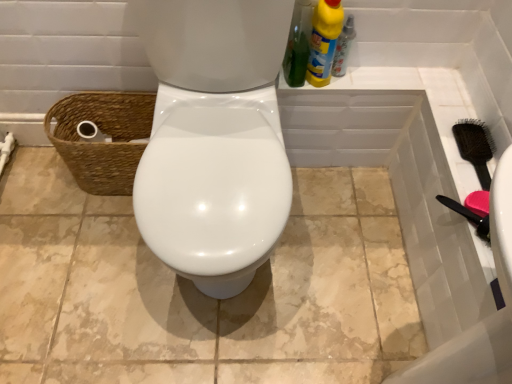
Question: Does yellow liquid cleaner at upper right, which is the 2th cleaning product from right to left, turn towards black plastic brush at right?

Choices:
 (A) no
 (B) yes

Answer: (A)

Question: From the image's perspective, would you say yellow liquid cleaner at upper right, which is the 2th cleaning product from right to left, is shown under black plastic brush at right?

Choices:
 (A) yes
 (B) no

Answer: (B)

Question: Is yellow liquid cleaner at upper right, which is the first cleaning product in left-to-right order, taller than black plastic brush at right?

Choices:
 (A) yes
 (B) no

Answer: (A)

Question: Is yellow liquid cleaner at upper right, which is the first cleaning product in left-to-right order, not inside black plastic brush at right?

Choices:
 (A) no
 (B) yes

Answer: (B)

Question: Considering the relative positions of yellow liquid cleaner at upper right, which is the first cleaning product in left-to-right order, and black plastic brush at right in the image provided, is yellow liquid cleaner at upper right, which is the first cleaning product in left-to-right order, in front of black plastic brush at right?

Choices:
 (A) yes
 (B) no

Answer: (A)

Question: From the image's perspective, is yellow plastic bottle at upper right positioned above or below brown woven basket at left?

Choices:
 (A) above
 (B) below

Answer: (A)

Question: Is yellow plastic bottle at upper right bigger or smaller than brown woven basket at left?

Choices:
 (A) small
 (B) big

Answer: (A)

Question: Is yellow plastic bottle at upper right in front of or behind brown woven basket at left in the image?

Choices:
 (A) behind
 (B) front

Answer: (B)

Question: Is yellow plastic bottle at upper right inside the boundaries of brown woven basket at left, or outside?

Choices:
 (A) outside
 (B) inside

Answer: (A)

Question: Considering the positions of yellow plastic bottle at upper right, placed as the first cleaning product when sorted from right to left, and brown woven basket at left in the image, is yellow plastic bottle at upper right, placed as the first cleaning product when sorted from right to left, bigger or smaller than brown woven basket at left?

Choices:
 (A) small
 (B) big

Answer: (A)

Question: In the image, is yellow plastic bottle at upper right, placed as the 2th cleaning product when sorted from left to right, on the left side or the right side of brown woven basket at left?

Choices:
 (A) left
 (B) right

Answer: (B)

Question: From the image's perspective, is yellow plastic bottle at upper right, placed as the 2th cleaning product when sorted from left to right, above or below brown woven basket at left?

Choices:
 (A) below
 (B) above

Answer: (B)

Question: In the image, is yellow plastic bottle at upper right, placed as the first cleaning product when sorted from right to left, positioned in front of or behind brown woven basket at left?

Choices:
 (A) front
 (B) behind

Answer: (A)

Question: Considering the positions of yellow liquid cleaner at upper right, which is the 2th cleaning product from right to left, and black plastic brush at right in the image, is yellow liquid cleaner at upper right, which is the 2th cleaning product from right to left, bigger or smaller than black plastic brush at right?

Choices:
 (A) big
 (B) small

Answer: (A)

Question: In terms of width, does yellow liquid cleaner at upper right, which is the 2th cleaning product from right to left, look wider or thinner when compared to black plastic brush at right?

Choices:
 (A) thin
 (B) wide

Answer: (B)